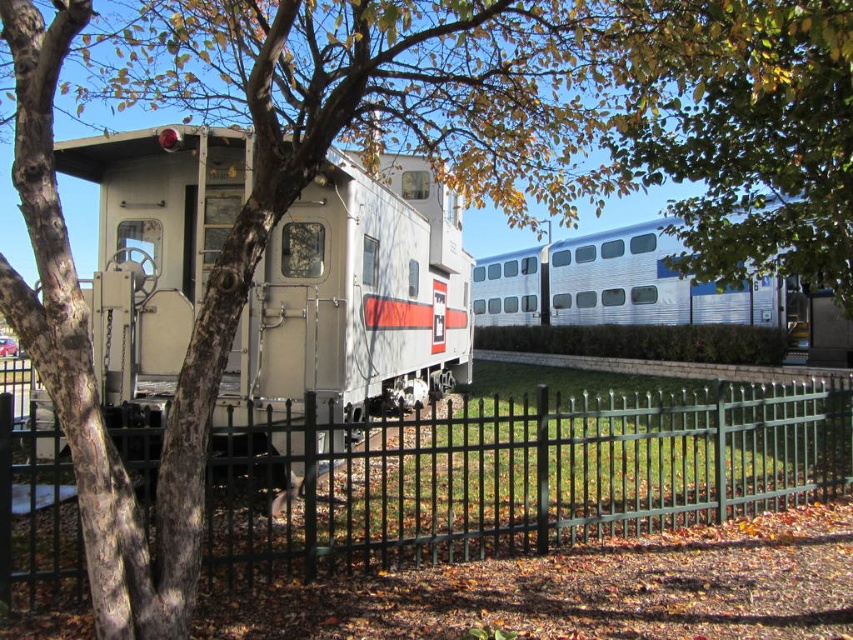
Question: In this image, where is green metal fence at center located relative to green leafy tree at upper center?

Choices:
 (A) left
 (B) right

Answer: (A)

Question: Is green metal fence at center above silver metallic train at center?

Choices:
 (A) no
 (B) yes

Answer: (A)

Question: Is green metal fence at center smaller than green leafy tree at upper center?

Choices:
 (A) yes
 (B) no

Answer: (B)

Question: Considering the real-world distances, which object is farthest from the silver metallic caboose at center?

Choices:
 (A) green leafy tree at upper center
 (B) silver metallic train at center

Answer: (B)

Question: Which object appears closest to the camera in this image?

Choices:
 (A) silver metallic caboose at center
 (B) green leafy tree at upper center
 (C) silver metallic train at center

Answer: (A)

Question: Estimate the real-world distances between objects in this image. Which object is farther from the silver metallic caboose at center?

Choices:
 (A) green leafy tree at upper center
 (B) green metal fence at center

Answer: (A)